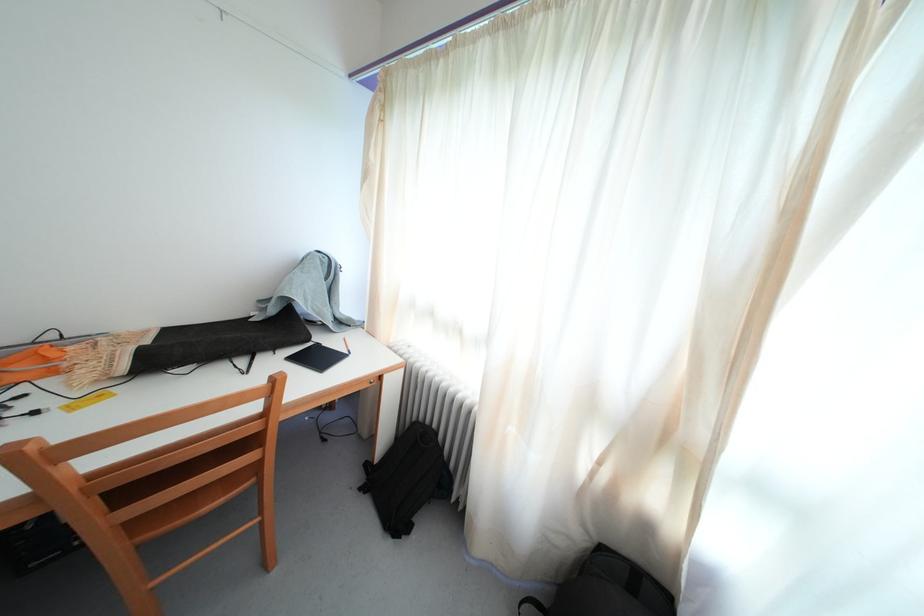
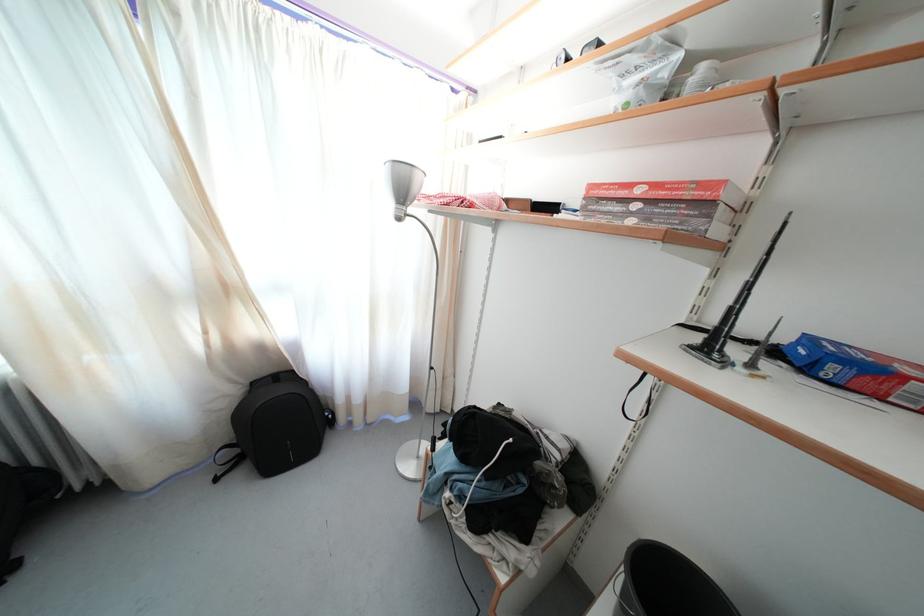
Where in the second image is the point corresponding to point 608,553 from the first image?

(259, 390)